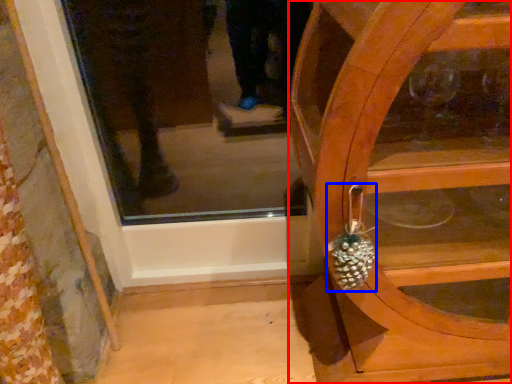
Question: Which of the following is the farthest to the observer, furniture (highlighted by a red box) or pineapple (highlighted by a blue box)?

Choices:
 (A) furniture
 (B) pineapple

Answer: (B)